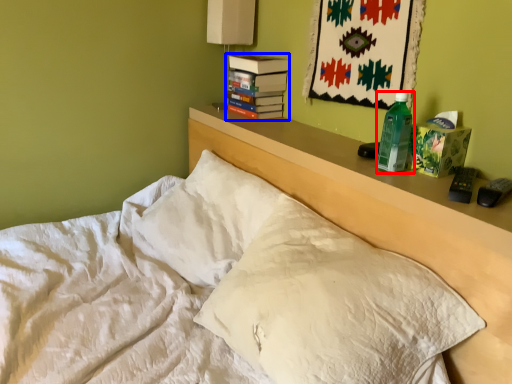
Question: Which object appears closest to the camera in this image, bottle (highlighted by a red box) or paperback book (highlighted by a blue box)?

Choices:
 (A) bottle
 (B) paperback book

Answer: (A)